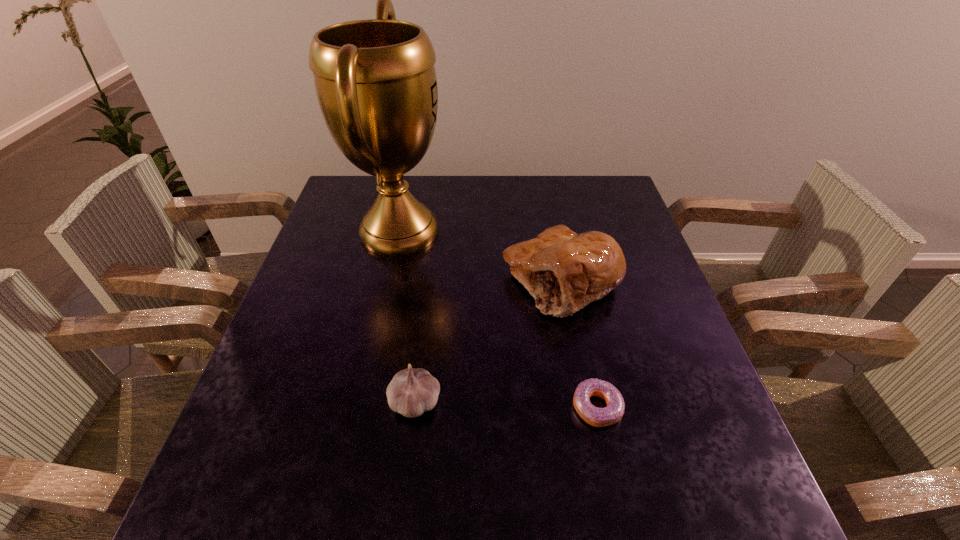
You are a GUI agent. You are given a task and a screenshot of the screen. Output one action in this format:
    pyautogui.click(x=<x>, y=<y>)
    Task: Click on the trophy cup
    The image size is (960, 540).
    Given the screenshot: What is the action you would take?
    pyautogui.click(x=375, y=79)

This screenshot has width=960, height=540. In order to click on bread in this screenshot , I will do `click(564, 271)`.

Where is `garlic`? The height and width of the screenshot is (540, 960). garlic is located at coordinates (411, 392).

Find the location of `doughnut`. doughnut is located at coordinates (598, 417).

Identify the location of vacant space located 0.060m on the surface of the trophy cup with symbols. This screenshot has width=960, height=540. [x=468, y=231].

Locate an element on the screen. free space located 0.400m on the filling side of the second tallest object is located at coordinates (346, 281).

I want to click on vacant region located on the filling side of the second tallest object, so click(428, 281).

Find the location of a particular element. vacant area situated 0.310m on the filling side of the second tallest object is located at coordinates (381, 281).

Locate an element on the screen. Image resolution: width=960 pixels, height=540 pixels. free space located on the left of the garlic is located at coordinates (353, 402).

Where is `free space located on the left of the doughnut`? Image resolution: width=960 pixels, height=540 pixels. free space located on the left of the doughnut is located at coordinates (501, 407).